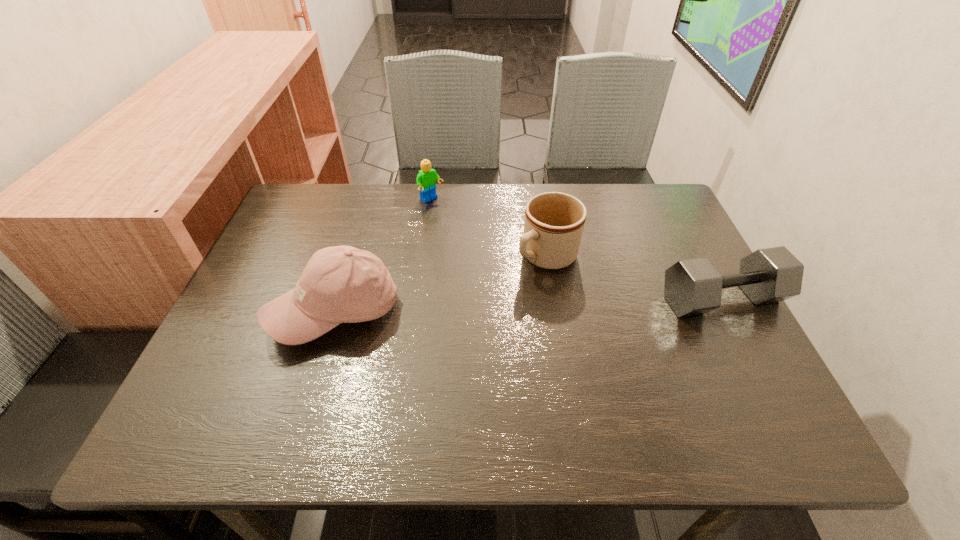
Locate an element on the screen. The image size is (960, 540). the leftmost object is located at coordinates (342, 284).

This screenshot has height=540, width=960. I want to click on the rightmost object, so click(692, 287).

The width and height of the screenshot is (960, 540). What are the coordinates of `the third object from left to right` in the screenshot? It's located at (554, 221).

Where is `the farthest object`? The width and height of the screenshot is (960, 540). the farthest object is located at coordinates (426, 179).

This screenshot has width=960, height=540. What are the coordinates of `the second object from left to right` in the screenshot? It's located at (426, 179).

Locate an element on the screen. The image size is (960, 540). free space located on the left of the rightmost object is located at coordinates coord(568,299).

The width and height of the screenshot is (960, 540). I want to click on vacant space located 0.380m on the side of the mug with the handle, so click(399, 359).

Locate an element on the screen. This screenshot has height=540, width=960. vacant space located 0.170m on the side of the mug with the handle is located at coordinates (474, 306).

The image size is (960, 540). I want to click on vacant space located 0.240m on the side of the mug with the handle, so click(x=451, y=322).

Where is `free space located 0.210m on the face of the Lego`? Image resolution: width=960 pixels, height=540 pixels. free space located 0.210m on the face of the Lego is located at coordinates (481, 243).